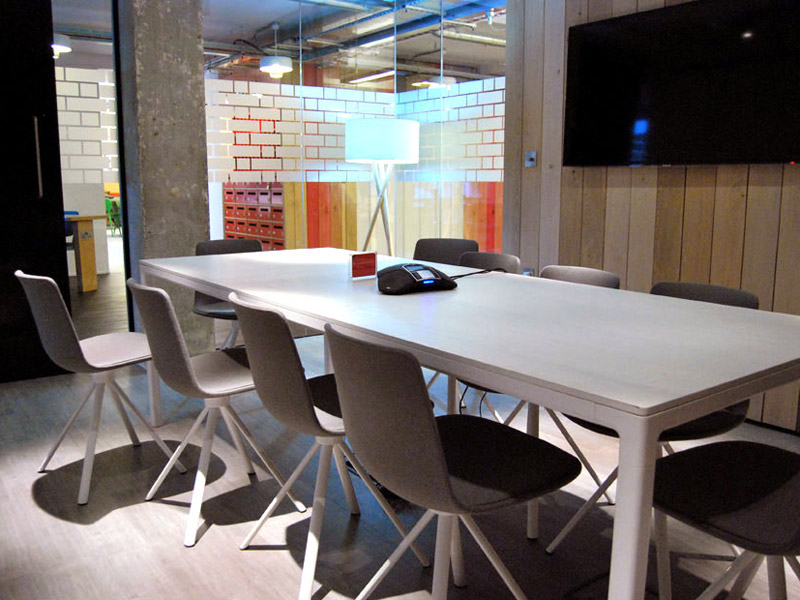
Locate an element on the screen. This screenshot has height=600, width=800. chairs on rigt side of table is located at coordinates (442, 247), (482, 257), (573, 274), (692, 295).